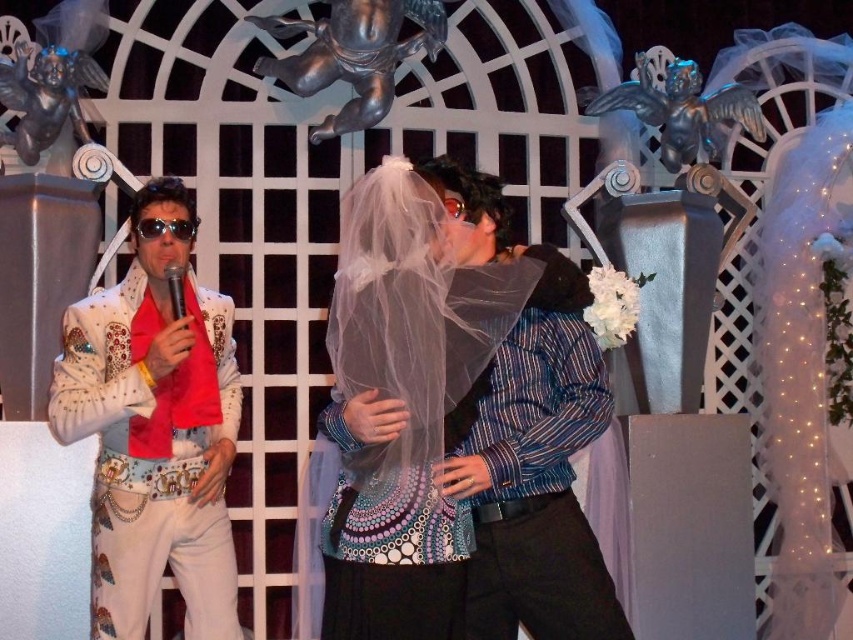
Between matte white veil at center and white sequined jacket at left, which one is positioned higher?

Positioned higher is matte white veil at center.

Between point (524, 248) and point (175, 536), which one is positioned in front?

Point (175, 536) is in front.

Who is more forward, (376, 548) or (180, 509)?

Point (376, 548)

Find the location of `matte white veil at center`. matte white veil at center is located at coordinates (502, 461).